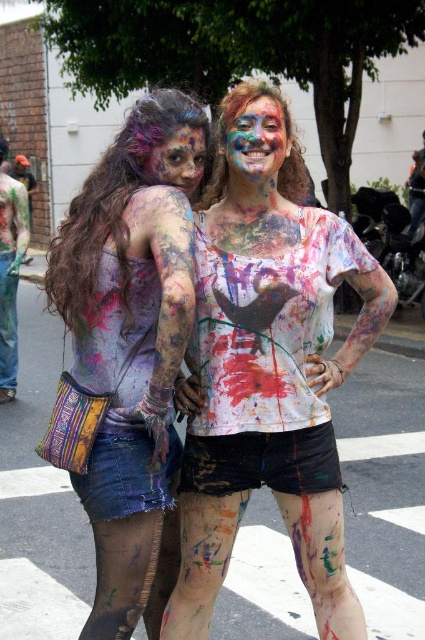
Between paint-covered skin at center and painted fabric skirt at center, which one has less height?

paint-covered skin at center

Does paint-covered skin at center have a greater width compared to painted fabric skirt at center?

Correct, the width of paint-covered skin at center exceeds that of painted fabric skirt at center.

The image size is (425, 640). I want to click on paint-covered skin at center, so click(x=268, y=381).

Which is more to the left, paint-covered skin at center or multicolored paint face at center?

multicolored paint face at center

Measure the distance between point (x=198, y=259) and camera.

A distance of 9.10 feet exists between point (x=198, y=259) and camera.

You are a GUI agent. You are given a task and a screenshot of the screen. Output one action in this format:
    pyautogui.click(x=<x>, y=<y>)
    Task: Click on the paint-covered skin at center
    This screenshot has height=640, width=425.
    Given the screenshot: What is the action you would take?
    pyautogui.click(x=268, y=381)

From the picture: Can you confirm if painted fabric skirt at center is positioned to the right of painted skin face at center?

No, painted fabric skirt at center is not to the right of painted skin face at center.

Is painted fabric skirt at center wider than painted skin face at center?

Yes, painted fabric skirt at center is wider than painted skin face at center.

Find the location of a particular element. painted fabric skirt at center is located at coordinates (127, 362).